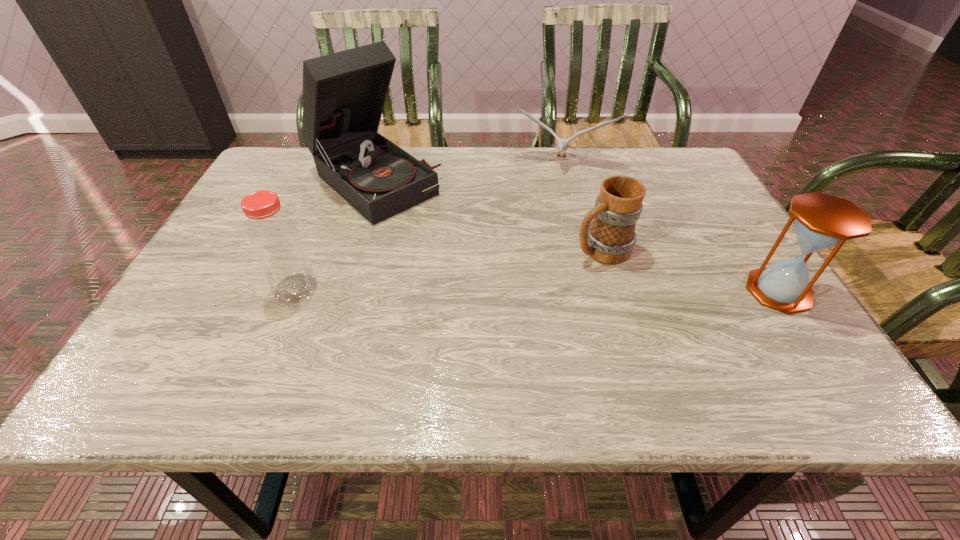
Image resolution: width=960 pixels, height=540 pixels. What are the coordinates of `object at the far left corner` in the screenshot? It's located at (344, 93).

The height and width of the screenshot is (540, 960). Find the location of `free space at the far edge of the desktop`. free space at the far edge of the desktop is located at coordinates (608, 172).

Where is `vacant space at the near edge of the desktop`? vacant space at the near edge of the desktop is located at coordinates (577, 331).

Where is `free region at the right edge`? free region at the right edge is located at coordinates (736, 291).

In the image, there is a desktop. Find the location of `free region at the near left corner`. free region at the near left corner is located at coordinates (240, 336).

This screenshot has height=540, width=960. In the image, there is a desktop. What are the coordinates of `vacant space at the far right corner` in the screenshot? It's located at (682, 158).

In the image, there is a desktop. Identify the location of vacant space at the near right corner. The width and height of the screenshot is (960, 540). (735, 320).

Where is `free spot between the hourglass and the tallest object`? The height and width of the screenshot is (540, 960). free spot between the hourglass and the tallest object is located at coordinates (576, 237).

This screenshot has height=540, width=960. I want to click on vacant point located between the third nearest object and the bottle, so click(448, 269).

What are the coordinates of `free space between the mug and the tallest object` in the screenshot? It's located at (488, 215).